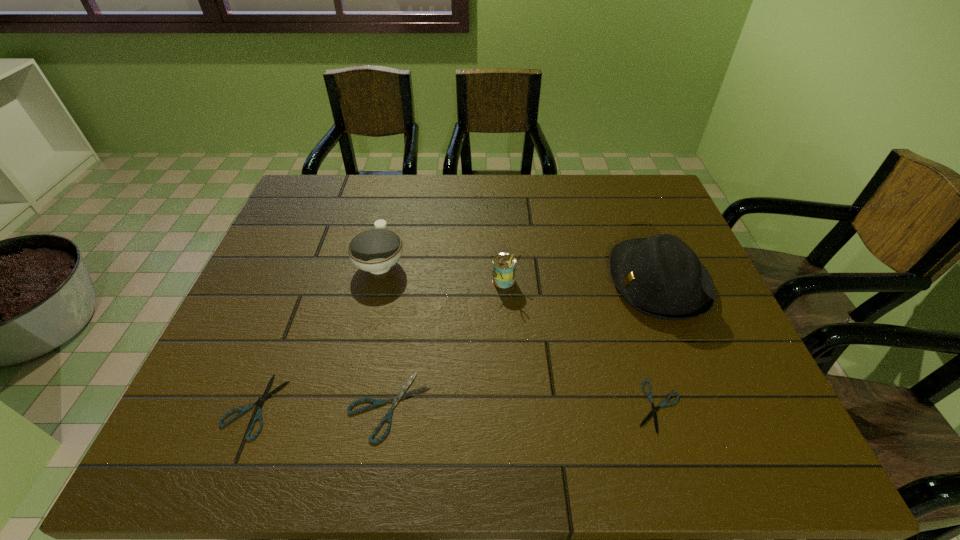
The image size is (960, 540). I want to click on empty location between the chinaware and the rightmost shears, so click(519, 334).

Locate an element on the screen. The image size is (960, 540). vacant area between the chinaware and the fedora is located at coordinates point(519,272).

Where is `empty space between the chinaware and the fifth shortest object`? This screenshot has width=960, height=540. empty space between the chinaware and the fifth shortest object is located at coordinates (443, 271).

Where is `free point between the can and the chinaware`? The width and height of the screenshot is (960, 540). free point between the can and the chinaware is located at coordinates (443, 271).

This screenshot has height=540, width=960. I want to click on free space between the fourth object from left to right and the leftmost shears, so click(x=380, y=343).

The width and height of the screenshot is (960, 540). Identify the location of free space between the shortest object and the fedora. (658, 344).

The height and width of the screenshot is (540, 960). In order to click on free space that is in between the can and the rightmost shears in this screenshot , I will do `click(582, 344)`.

Identify the location of vacant space in between the second shears from right to left and the fedora. The height and width of the screenshot is (540, 960). [x=523, y=344].

I want to click on vacant space that is in between the fifth tallest object and the second tallest object, so click(x=380, y=343).

Find the location of a particular element. the third closest object relative to the fedora is located at coordinates (400, 395).